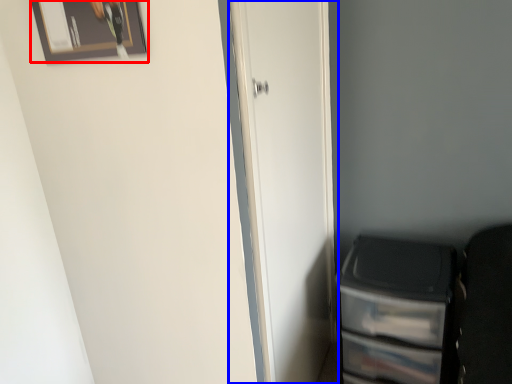
Question: Which object appears closest to the camera in this image, picture frame (highlighted by a red box) or door (highlighted by a blue box)?

Choices:
 (A) picture frame
 (B) door

Answer: (A)